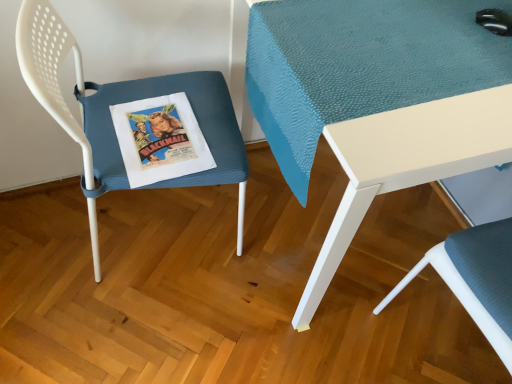
The image size is (512, 384). In order to click on blue textured cushion at left, which appears as the 2th chair when viewed from the right in this screenshot , I will do `click(124, 102)`.

What do you see at coordinates (379, 98) in the screenshot? I see `teal fabric table at center` at bounding box center [379, 98].

Identify the location of textured blue cushion at lower right, placed as the second chair when sorted from left to right. (476, 279).

Consider the image. Between textured blue cushion at lower right, placed as the second chair when sorted from left to right, and blue textured cushion at left, which is the 1th chair from left to right, which one appears on the left side from the viewer's perspective?

blue textured cushion at left, which is the 1th chair from left to right.

Measure the distance between textured blue cushion at lower right, placed as the second chair when sorted from left to right, and blue textured cushion at left, which is the 1th chair from left to right.

textured blue cushion at lower right, placed as the second chair when sorted from left to right, and blue textured cushion at left, which is the 1th chair from left to right, are 28.61 inches apart.

Considering the sizes of textured blue cushion at lower right, the first chair positioned from the right, and blue textured cushion at left, which appears as the 2th chair when viewed from the right, in the image, is textured blue cushion at lower right, the first chair positioned from the right, wider or thinner than blue textured cushion at left, which appears as the 2th chair when viewed from the right,?

Clearly, textured blue cushion at lower right, the first chair positioned from the right, has less width compared to blue textured cushion at left, which appears as the 2th chair when viewed from the right.

Which of these two, teal fabric table at center or blue textured cushion at left, which appears as the 2th chair when viewed from the right, stands taller?

Standing taller between the two is blue textured cushion at left, which appears as the 2th chair when viewed from the right.

Is point (272, 150) farther from viewer compared to point (49, 48)?

Yes, it is.

Can you confirm if teal fabric table at center is thinner than blue textured cushion at left, which appears as the 2th chair when viewed from the right?

No, teal fabric table at center is not thinner than blue textured cushion at left, which appears as the 2th chair when viewed from the right.

Do you think teal fabric table at center is within blue textured cushion at left, which is the 1th chair from left to right, or outside of it?

teal fabric table at center exists outside the volume of blue textured cushion at left, which is the 1th chair from left to right.

Is point (82, 98) closer or farther from the camera than point (476, 322)?

Clearly, point (82, 98) is more distant from the camera than point (476, 322).

Can you tell me how much blue textured cushion at left, which is the 1th chair from left to right, and textured blue cushion at lower right, placed as the second chair when sorted from left to right, differ in facing direction?

blue textured cushion at left, which is the 1th chair from left to right, and textured blue cushion at lower right, placed as the second chair when sorted from left to right, are facing 180 degrees away from each other.

Is blue textured cushion at left, which appears as the 2th chair when viewed from the right, inside or outside of textured blue cushion at lower right, placed as the second chair when sorted from left to right?

blue textured cushion at left, which appears as the 2th chair when viewed from the right, is located beyond the bounds of textured blue cushion at lower right, placed as the second chair when sorted from left to right.

From the picture: Is blue textured cushion at left, which appears as the 2th chair when viewed from the right, bigger than textured blue cushion at lower right, placed as the second chair when sorted from left to right?

Yes.

Would you say teal fabric table at center is outside textured blue cushion at lower right, placed as the second chair when sorted from left to right?

Absolutely, teal fabric table at center is external to textured blue cushion at lower right, placed as the second chair when sorted from left to right.

Is teal fabric table at center wider than textured blue cushion at lower right, the first chair positioned from the right?

Indeed, teal fabric table at center has a greater width compared to textured blue cushion at lower right, the first chair positioned from the right.

From the picture: Is teal fabric table at center not near textured blue cushion at lower right, placed as the second chair when sorted from left to right?

teal fabric table at center is near textured blue cushion at lower right, placed as the second chair when sorted from left to right, not far away.

How much distance is there between teal fabric table at center and textured blue cushion at lower right, placed as the second chair when sorted from left to right?

They are 15.57 inches apart.

Which is in front, point (488, 291) or point (411, 133)?

The point (411, 133) is closer to the camera.

Is teal fabric table at center a part of textured blue cushion at lower right, placed as the second chair when sorted from left to right?

No.

Does textured blue cushion at lower right, the first chair positioned from the right, turn towards teal fabric table at center?

No, textured blue cushion at lower right, the first chair positioned from the right, is not oriented towards teal fabric table at center.

From the image's perspective, is textured blue cushion at lower right, the first chair positioned from the right, located beneath teal fabric table at center?

Yes, from the image's perspective, textured blue cushion at lower right, the first chair positioned from the right, is beneath teal fabric table at center.

Is teal fabric table at center a part of blue textured cushion at left, which is the 1th chair from left to right?

No, teal fabric table at center is not surrounded by blue textured cushion at left, which is the 1th chair from left to right.

Does blue textured cushion at left, which is the 1th chair from left to right, have a smaller size compared to teal fabric table at center?

Indeed, blue textured cushion at left, which is the 1th chair from left to right, has a smaller size compared to teal fabric table at center.

Looking at this image, between blue textured cushion at left, which is the 1th chair from left to right, and teal fabric table at center, which one has less height?

Standing shorter between the two is teal fabric table at center.

Does blue textured cushion at left, which is the 1th chair from left to right, touch teal fabric table at center?

No, blue textured cushion at left, which is the 1th chair from left to right, is not with teal fabric table at center.

Identify the location of chair located above the textured blue cushion at lower right, the first chair positioned from the right (from the image's perspective). (124, 102).

Find the location of `table on the right of blue textured cushion at left, which appears as the 2th chair when viewed from the right`. table on the right of blue textured cushion at left, which appears as the 2th chair when viewed from the right is located at coordinates (379, 98).

From the image, which object appears to be nearer to blue textured cushion at left, which is the 1th chair from left to right, textured blue cushion at lower right, placed as the second chair when sorted from left to right, or teal fabric table at center?

Based on the image, teal fabric table at center appears to be nearer to blue textured cushion at left, which is the 1th chair from left to right.

Looking at the image, which one is located further to teal fabric table at center, blue textured cushion at left, which appears as the 2th chair when viewed from the right, or textured blue cushion at lower right, the first chair positioned from the right?

The object further to teal fabric table at center is textured blue cushion at lower right, the first chair positioned from the right.

Based on their spatial positions, is textured blue cushion at lower right, placed as the second chair when sorted from left to right, or blue textured cushion at left, which appears as the 2th chair when viewed from the right, closer to teal fabric table at center?

Based on the image, blue textured cushion at left, which appears as the 2th chair when viewed from the right, appears to be nearer to teal fabric table at center.

Looking at the image, which one is located closer to blue textured cushion at left, which appears as the 2th chair when viewed from the right, teal fabric table at center or textured blue cushion at lower right, placed as the second chair when sorted from left to right?

The object closer to blue textured cushion at left, which appears as the 2th chair when viewed from the right, is teal fabric table at center.

Estimate the real-world distances between objects in this image. Which object is closer to textured blue cushion at lower right, the first chair positioned from the right, blue textured cushion at left, which is the 1th chair from left to right, or teal fabric table at center?

Based on the image, teal fabric table at center appears to be nearer to textured blue cushion at lower right, the first chair positioned from the right.

From the picture: From the image, which object appears to be farther from textured blue cushion at lower right, placed as the second chair when sorted from left to right, teal fabric table at center or blue textured cushion at left, which is the 1th chair from left to right?

blue textured cushion at left, which is the 1th chair from left to right.

Identify the location of table situated between blue textured cushion at left, which is the 1th chair from left to right, and textured blue cushion at lower right, placed as the second chair when sorted from left to right, from left to right. (379, 98).